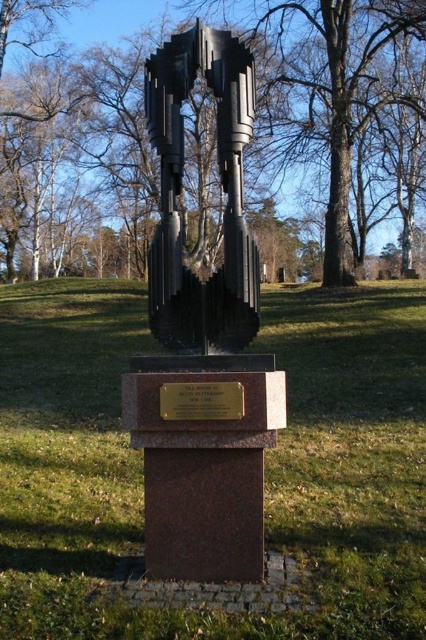
Question: Which object appears farthest from the camera in this image?

Choices:
 (A) black metal tree at center
 (B) green grass at center
 (C) gold plated metal plaque at center
 (D) polished bronze sculpture at center

Answer: (A)

Question: Which point appears closest to the camera in this image?

Choices:
 (A) (294, 512)
 (B) (184, 410)

Answer: (B)

Question: Is black metal tree at center to the right of black polished metal sculpture at center from the viewer's perspective?

Choices:
 (A) no
 (B) yes

Answer: (A)

Question: Can you confirm if polished bronze sculpture at center is smaller than gold plated metal plaque at center?

Choices:
 (A) yes
 (B) no

Answer: (B)

Question: Does green grass at center come in front of black polished metal sculpture at center?

Choices:
 (A) yes
 (B) no

Answer: (A)

Question: Which point is closer to the camera?

Choices:
 (A) gold plated metal plaque at center
 (B) green grass at center
 (C) polished bronze sculpture at center

Answer: (B)